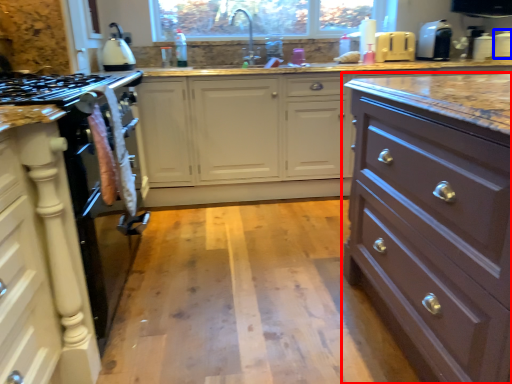
Question: Which of the following is the farthest to the observer, chest of drawers (highlighted by a red box) or appliance (highlighted by a blue box)?

Choices:
 (A) chest of drawers
 (B) appliance

Answer: (B)